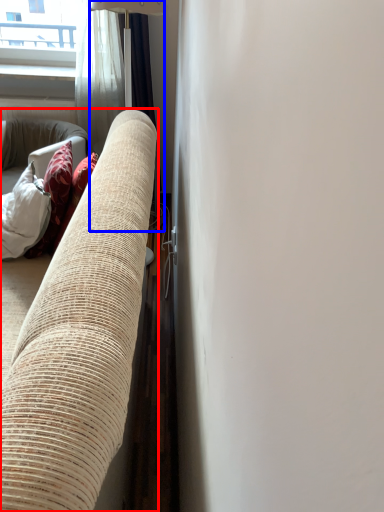
Question: Which of the following is the farthest to the observer, studio couch (highlighted by a red box) or curtain (highlighted by a blue box)?

Choices:
 (A) studio couch
 (B) curtain

Answer: (B)